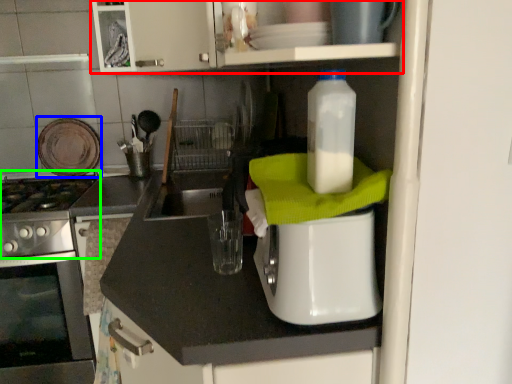
Question: Estimate the real-world distances between objects in this image. Which object is closer to cabinetry (highlighted by a red box), appliance (highlighted by a blue box) or gas stove (highlighted by a green box)?

Choices:
 (A) appliance
 (B) gas stove

Answer: (A)